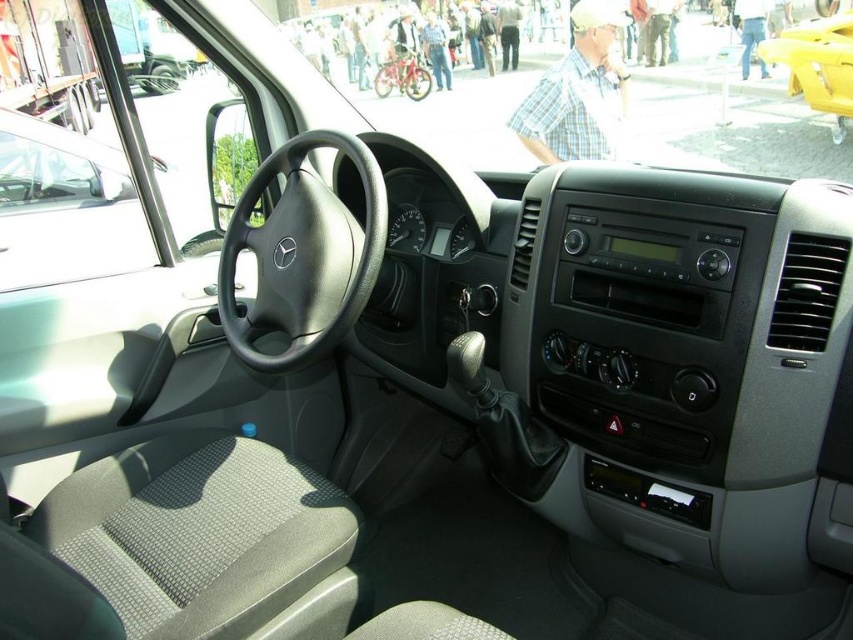
Is black leather steering wheel at center to the right of metallic red bicycle at center from the viewer's perspective?

Yes, black leather steering wheel at center is to the right of metallic red bicycle at center.

The width and height of the screenshot is (853, 640). What do you see at coordinates (302, 253) in the screenshot? I see `black leather steering wheel at center` at bounding box center [302, 253].

Describe the element at coordinates (302, 253) in the screenshot. The width and height of the screenshot is (853, 640). I see `black leather steering wheel at center` at that location.

Locate an element on the screen. Image resolution: width=853 pixels, height=640 pixels. black leather steering wheel at center is located at coordinates (302, 253).